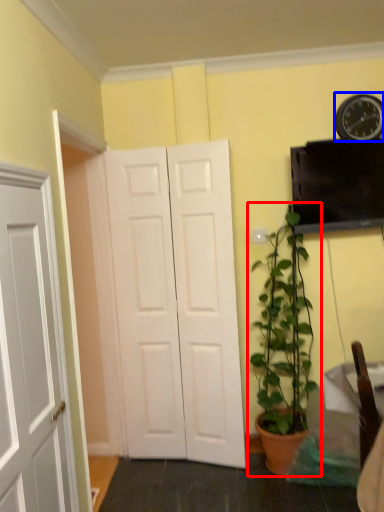
Question: Which object appears farthest to the camera in this image, houseplant (highlighted by a red box) or clock (highlighted by a blue box)?

Choices:
 (A) houseplant
 (B) clock

Answer: (B)